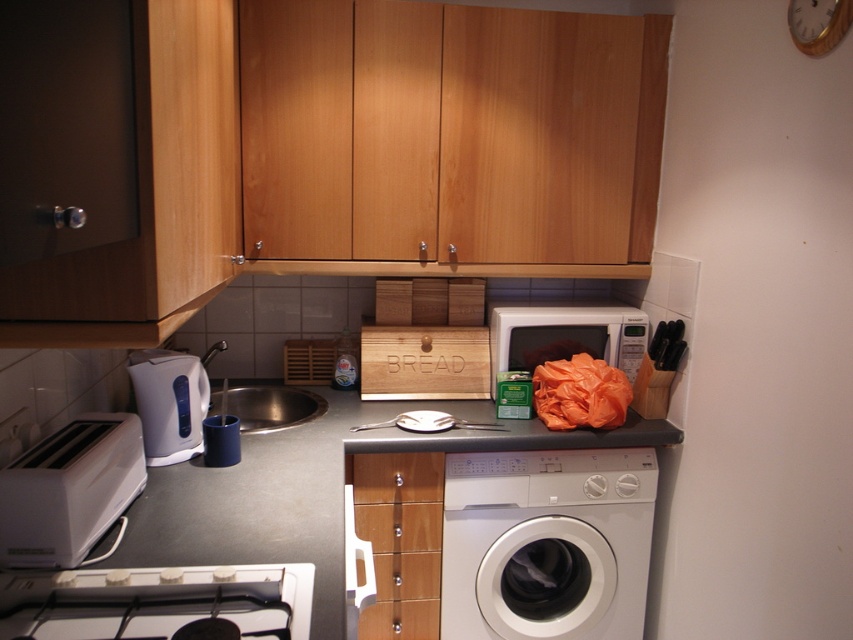
Question: Observing the image, what is the correct spatial positioning of white glossy stove at lower left in reference to white plastic toaster at lower left?

Choices:
 (A) below
 (B) above

Answer: (A)

Question: Among these points, which one is farthest from the camera?

Choices:
 (A) (796, 33)
 (B) (22, 458)
 (C) (279, 426)
 (D) (296, 602)

Answer: (C)

Question: Estimate the real-world distances between objects in this image. Which object is farther from the smooth gray countertop at center?

Choices:
 (A) white plastic toaster at lower left
 (B) white matte microwave at center

Answer: (B)

Question: Can you confirm if white glossy stove at lower left is bigger than white plastic kettle at left?

Choices:
 (A) no
 (B) yes

Answer: (A)

Question: Which object is closer to the camera taking this photo?

Choices:
 (A) smooth gray countertop at center
 (B) white matte microwave at center
 (C) wooden clock at upper right
 (D) white glossy washing machine at lower right

Answer: (A)

Question: Can you confirm if smooth gray countertop at center is positioned below wooden clock at upper right?

Choices:
 (A) yes
 (B) no

Answer: (A)